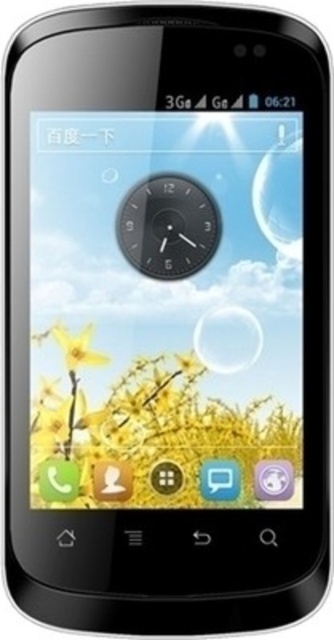
Is black matte clock at center bigger than transparent glass bubble at center?

Correct, black matte clock at center is larger in size than transparent glass bubble at center.

Who is lower down, black matte clock at center or transparent glass bubble at center?

transparent glass bubble at center is below.

Is point (203, 211) positioned in front of point (256, 320)?

No, it is not.

Locate an element on the screen. black matte clock at center is located at coordinates (168, 227).

Measure the distance from transparent glass bubble at upper right to transparent glass bubble at center.

They are 5.64 inches apart.

Where is `transparent glass bubble at upper right`? Image resolution: width=334 pixels, height=640 pixels. transparent glass bubble at upper right is located at coordinates (279, 195).

Can you confirm if black matte clock at center is shorter than transparent glass bubble at upper right?

Yes, black matte clock at center is shorter than transparent glass bubble at upper right.

The height and width of the screenshot is (640, 334). Describe the element at coordinates (168, 227) in the screenshot. I see `black matte clock at center` at that location.

Locate an element on the screen. This screenshot has width=334, height=640. black matte clock at center is located at coordinates (168, 227).